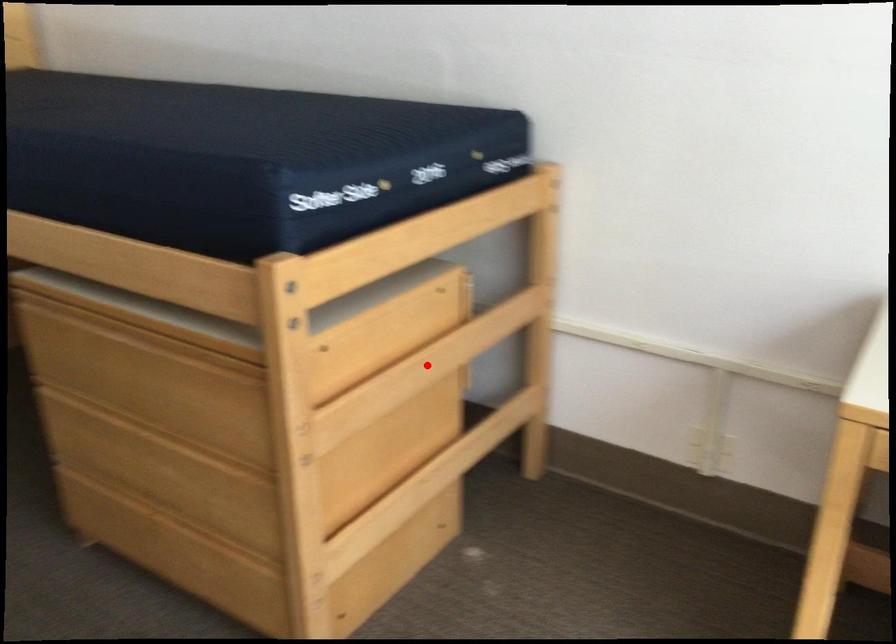
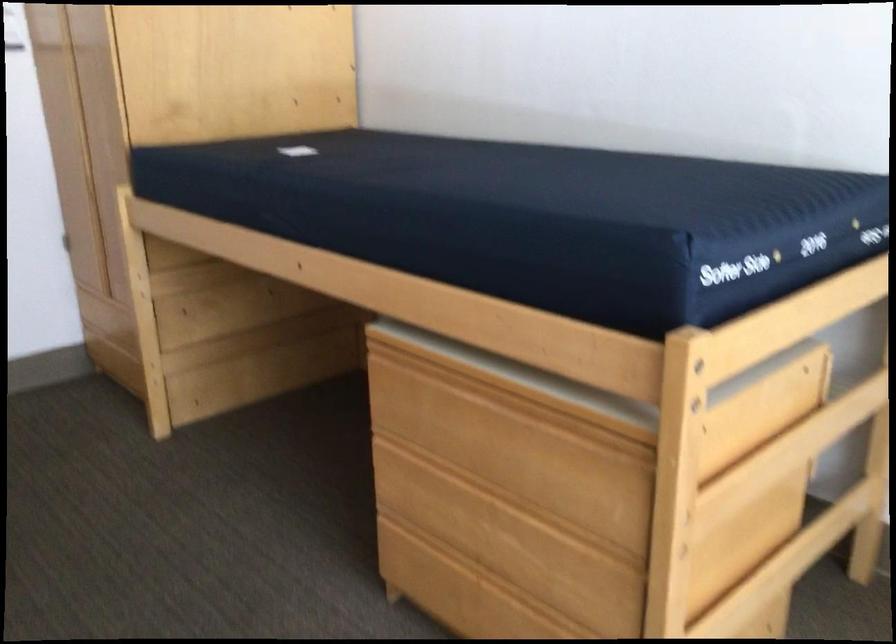
Question: I am providing you with two images of the same scene from different viewpoints. Image1 has a red point marked. In image2, the corresponding 3D location appears at what relative position? Reply with the corresponding letter.

Choices:
 (A) Closer
 (B) Farther

Answer: (A)